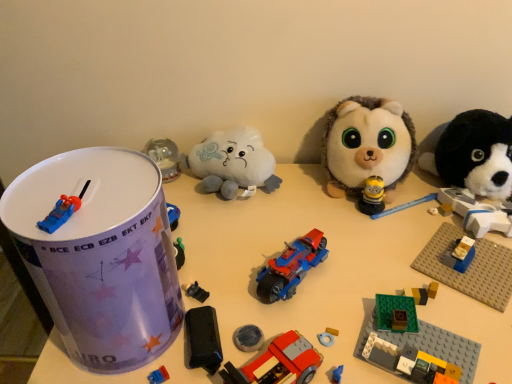
Locate an element on the screen. free area in between shiny plastic motorcycle at center, which is the sixth toy in left-to-right order, and green plastic building block at lower right, the third toy from the right is located at coordinates (344, 306).